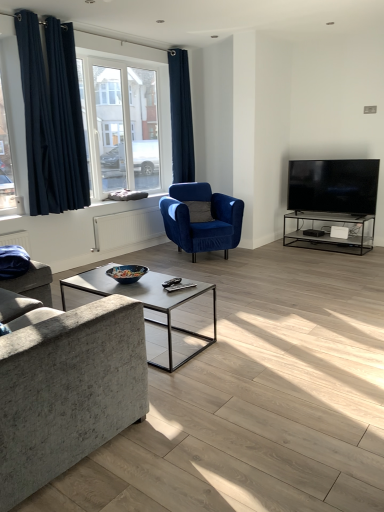
Locate an element on the screen. The height and width of the screenshot is (512, 384). velvet blue armchair at center is located at coordinates (201, 218).

Where is `textured gray fabric couch at left`? textured gray fabric couch at left is located at coordinates (68, 391).

Can you tell me how much clear glass window at upper left and dark blue velvet curtains at left, which is the 2th curtain in back-to-front order, differ in facing direction?

0.00588 degrees.

Which of these two, clear glass window at upper left or dark blue velvet curtains at left, which appears as the first curtain when viewed from the left, stands taller?

dark blue velvet curtains at left, which appears as the first curtain when viewed from the left, is taller.

You are a GUI agent. You are given a task and a screenshot of the screen. Output one action in this format:
    pyautogui.click(x=<x>, y=<y>)
    Task: Click on the window on the right of dark blue velvet curtains at left, which is the 2th curtain in back-to-front order
    
    Given the screenshot: What is the action you would take?
    pyautogui.click(x=123, y=125)

Does clear glass window at upper left come in front of dark blue velvet curtains at left, the 1th curtain in the front-to-back sequence?

No.

From a real-world perspective, which is physically below, dark blue velvet curtains at left, the 2th curtain positioned from the right, or clear glass window at upper left?

clear glass window at upper left is physically lower.

Considering the relative positions of dark blue velvet curtains at left, the 2th curtain positioned from the right, and clear glass window at upper left in the image provided, is dark blue velvet curtains at left, the 2th curtain positioned from the right, behind clear glass window at upper left?

No, dark blue velvet curtains at left, the 2th curtain positioned from the right, is closer to the viewer.

Is point (74, 124) closer or farther from the camera than point (134, 81)?

Point (74, 124) appears to be closer to the viewer than point (134, 81).

From the image's perspective, which one is positioned higher, dark blue velvet curtains at left, which appears as the first curtain when viewed from the left, or clear glass window at upper left?

clear glass window at upper left, from the image's perspective.

Is dark blue velvet curtain at upper center, arranged as the first curtain when viewed from the right, thinner than velvet blue armchair at center?

Yes.

Is dark blue velvet curtain at upper center, the second curtain from the front, further to camera compared to velvet blue armchair at center?

Yes, the depth of dark blue velvet curtain at upper center, the second curtain from the front, is greater than that of velvet blue armchair at center.

Considering the sizes of dark blue velvet curtain at upper center, the 2th curtain viewed from the left, and velvet blue armchair at center in the image, is dark blue velvet curtain at upper center, the 2th curtain viewed from the left, taller or shorter than velvet blue armchair at center?

In the image, dark blue velvet curtain at upper center, the 2th curtain viewed from the left, appears to be taller than velvet blue armchair at center.

Can you tell me how much dark blue velvet curtain at upper center, arranged as the first curtain when viewed from the right, and clear glass window at upper left differ in facing direction?

The angular difference between dark blue velvet curtain at upper center, arranged as the first curtain when viewed from the right, and clear glass window at upper left is 0.00814 degrees.

In the scene shown: Is dark blue velvet curtain at upper center, positioned as the 1th curtain in back-to-front order, shorter than clear glass window at upper left?

No, dark blue velvet curtain at upper center, positioned as the 1th curtain in back-to-front order, is not shorter than clear glass window at upper left.

Who is more distant, dark blue velvet curtain at upper center, the second curtain from the front, or clear glass window at upper left?

dark blue velvet curtain at upper center, the second curtain from the front, is more distant.

Is dark blue velvet curtain at upper center, positioned as the 1th curtain in back-to-front order, smaller than clear glass window at upper left?

Yes.

From a real-world perspective, is dark blue velvet curtains at left, the 1th curtain in the front-to-back sequence, physically above textured gray fabric couch at left?

Yes, from a real-world perspective, dark blue velvet curtains at left, the 1th curtain in the front-to-back sequence, is above textured gray fabric couch at left.

From the image's perspective, is dark blue velvet curtains at left, which is the 2th curtain in back-to-front order, below textured gray fabric couch at left?

Actually, dark blue velvet curtains at left, which is the 2th curtain in back-to-front order, appears above textured gray fabric couch at left in the image.

Is dark blue velvet curtains at left, which is the 2th curtain in back-to-front order, directly adjacent to textured gray fabric couch at left?

dark blue velvet curtains at left, which is the 2th curtain in back-to-front order, and textured gray fabric couch at left are not in contact.

Considering the sizes of dark blue velvet curtains at left, the 2th curtain positioned from the right, and textured gray fabric couch at left in the image, is dark blue velvet curtains at left, the 2th curtain positioned from the right, wider or thinner than textured gray fabric couch at left?

Clearly, dark blue velvet curtains at left, the 2th curtain positioned from the right, has less width compared to textured gray fabric couch at left.

Considering the relative sizes of velvet blue armchair at center and dark blue velvet curtain at upper center, positioned as the 1th curtain in back-to-front order, in the image provided, is velvet blue armchair at center thinner than dark blue velvet curtain at upper center, positioned as the 1th curtain in back-to-front order,?

In fact, velvet blue armchair at center might be wider than dark blue velvet curtain at upper center, positioned as the 1th curtain in back-to-front order.

Considering the relative positions of velvet blue armchair at center and dark blue velvet curtain at upper center, the second curtain from the front, in the image provided, is velvet blue armchair at center to the right of dark blue velvet curtain at upper center, the second curtain from the front, from the viewer's perspective?

Correct, you'll find velvet blue armchair at center to the right of dark blue velvet curtain at upper center, the second curtain from the front.

Is velvet blue armchair at center inside or outside of dark blue velvet curtain at upper center, positioned as the 1th curtain in back-to-front order?

velvet blue armchair at center is not enclosed by dark blue velvet curtain at upper center, positioned as the 1th curtain in back-to-front order.

The height and width of the screenshot is (512, 384). Find the location of `chair below the dark blue velvet curtain at upper center, positioned as the 1th curtain in back-to-front order (from a real-world perspective)`. chair below the dark blue velvet curtain at upper center, positioned as the 1th curtain in back-to-front order (from a real-world perspective) is located at coordinates (201, 218).

How much distance is there between dark blue velvet curtain at upper center, the second curtain from the front, and textured gray fabric couch at left?

4.64 meters.

From the image's perspective, is dark blue velvet curtain at upper center, the second curtain from the front, over textured gray fabric couch at left?

Yes, from the image's perspective, dark blue velvet curtain at upper center, the second curtain from the front, is on top of textured gray fabric couch at left.

Is dark blue velvet curtain at upper center, the second curtain from the front, positioned with its back to textured gray fabric couch at left?

No, dark blue velvet curtain at upper center, the second curtain from the front,'s orientation is not away from textured gray fabric couch at left.

Do you think dark blue velvet curtain at upper center, arranged as the first curtain when viewed from the right, is within textured gray fabric couch at left, or outside of it?

dark blue velvet curtain at upper center, arranged as the first curtain when viewed from the right, cannot be found inside textured gray fabric couch at left.

You are a GUI agent. You are given a task and a screenshot of the screen. Output one action in this format:
    pyautogui.click(x=<x>, y=<y>)
    Task: Click on the window above the dark blue velvet curtains at left, which is the 2th curtain in back-to-front order (from the image's perspective)
    Image resolution: width=384 pixels, height=512 pixels.
    Given the screenshot: What is the action you would take?
    pyautogui.click(x=123, y=125)

Find the location of `curtain lying in front of the clear glass window at upper left`. curtain lying in front of the clear glass window at upper left is located at coordinates (52, 116).

Considering their positions, is dark blue velvet curtain at upper center, the 2th curtain viewed from the left, positioned further to clear glass window at upper left than velvet blue armchair at center?

velvet blue armchair at center lies further to clear glass window at upper left than the other object.

Estimate the real-world distances between objects in this image. Which object is further from velvet blue armchair at center, clear glass window at upper left or dark blue velvet curtain at upper center, arranged as the first curtain when viewed from the right?

dark blue velvet curtain at upper center, arranged as the first curtain when viewed from the right, is further to velvet blue armchair at center.

From the image, which object appears to be farther from dark blue velvet curtains at left, which appears as the first curtain when viewed from the left, clear glass window at upper left or velvet blue armchair at center?

velvet blue armchair at center lies further to dark blue velvet curtains at left, which appears as the first curtain when viewed from the left, than the other object.

Which object lies further to the anchor point velvet blue armchair at center, dark blue velvet curtains at left, the 1th curtain in the front-to-back sequence, or textured gray fabric couch at left?

textured gray fabric couch at left.

Based on their spatial positions, is textured gray fabric couch at left or dark blue velvet curtain at upper center, the 2th curtain viewed from the left, closer to velvet blue armchair at center?

Among the two, dark blue velvet curtain at upper center, the 2th curtain viewed from the left, is located nearer to velvet blue armchair at center.

Which object lies nearer to the anchor point velvet blue armchair at center, dark blue velvet curtains at left, which is the 2th curtain in back-to-front order, or clear glass window at upper left?

Based on the image, clear glass window at upper left appears to be nearer to velvet blue armchair at center.

From the image, which object appears to be nearer to dark blue velvet curtain at upper center, arranged as the first curtain when viewed from the right, dark blue velvet curtains at left, the 1th curtain in the front-to-back sequence, or textured gray fabric couch at left?

The object closer to dark blue velvet curtain at upper center, arranged as the first curtain when viewed from the right, is dark blue velvet curtains at left, the 1th curtain in the front-to-back sequence.

Looking at the image, which one is located further to textured gray fabric couch at left, clear glass window at upper left or dark blue velvet curtain at upper center, the second curtain from the front?

dark blue velvet curtain at upper center, the second curtain from the front, lies further to textured gray fabric couch at left than the other object.

You are a GUI agent. You are given a task and a screenshot of the screen. Output one action in this format:
    pyautogui.click(x=<x>, y=<y>)
    Task: Click on the chair located between textured gray fabric couch at left and clear glass window at upper left in the depth direction
    The image size is (384, 512).
    Given the screenshot: What is the action you would take?
    pyautogui.click(x=201, y=218)

Find the location of `curtain between dark blue velvet curtains at left, the 2th curtain positioned from the right, and velvet blue armchair at center, in the horizontal direction`. curtain between dark blue velvet curtains at left, the 2th curtain positioned from the right, and velvet blue armchair at center, in the horizontal direction is located at coordinates (181, 117).

Where is `window between dark blue velvet curtains at left, the 2th curtain positioned from the right, and velvet blue armchair at center from left to right`? The image size is (384, 512). window between dark blue velvet curtains at left, the 2th curtain positioned from the right, and velvet blue armchair at center from left to right is located at coordinates (123, 125).

Locate an element on the screen. This screenshot has width=384, height=512. chair located between textured gray fabric couch at left and dark blue velvet curtain at upper center, the second curtain from the front, in the depth direction is located at coordinates [x=201, y=218].